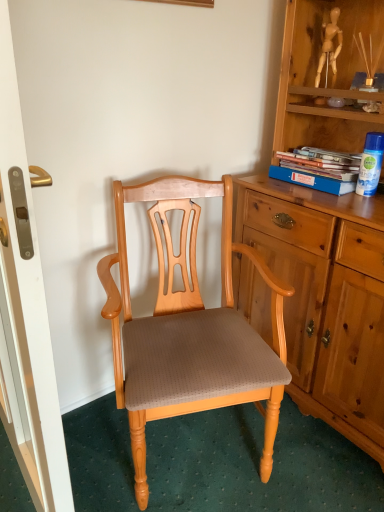
At what (x,y) coordinates should I click in order to perform the action: click on vacant space in light brown wood chair at center (from a real-world perspective). Please return your answer as a coordinate pair (x, y). This screenshot has height=512, width=384. Looking at the image, I should click on (201, 471).